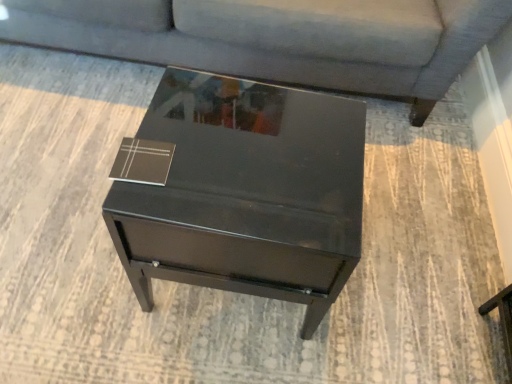
The width and height of the screenshot is (512, 384). In order to click on vacant space behind brown leather book at upper left in this screenshot , I will do `click(184, 109)`.